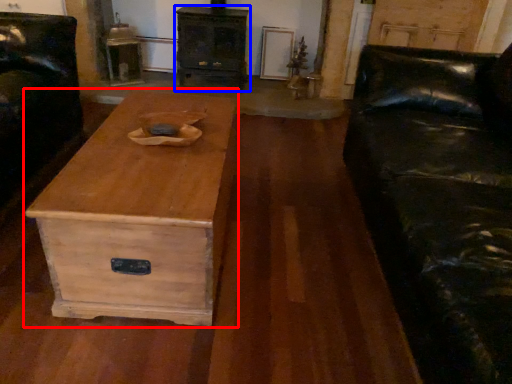
Question: Which object is further to the camera taking this photo, coffee table (highlighted by a red box) or chest of drawers (highlighted by a blue box)?

Choices:
 (A) coffee table
 (B) chest of drawers

Answer: (B)